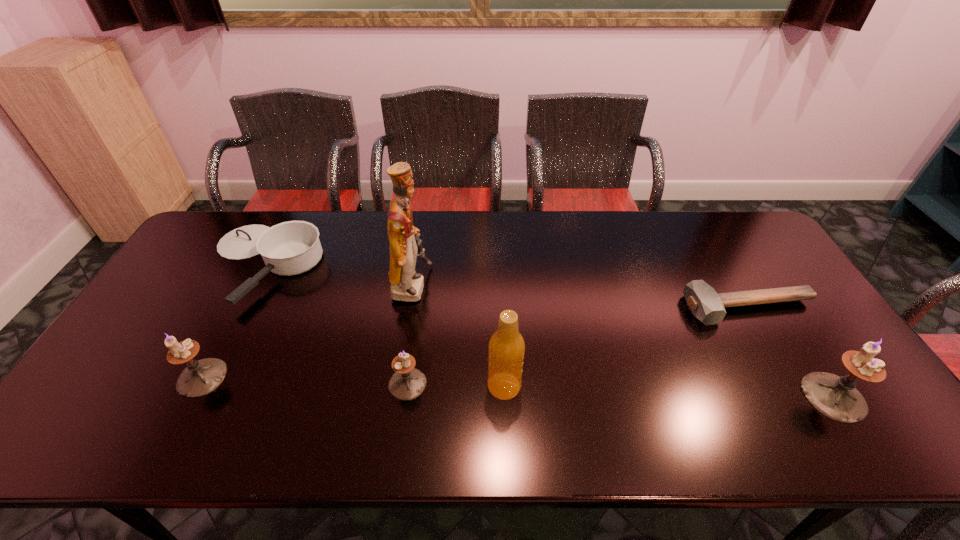
Find the location of a particular element. The height and width of the screenshot is (540, 960). object that is the second closest to the tallest candle holder is located at coordinates (506, 349).

Locate which candle holder ranks second in proximity to the second candle holder from left to right. Please provide its 2D coordinates. Your answer should be formatted as a tuple, i.e. [(x, y)], where the tuple contains the x and y coordinates of a point satisfying the conditions above.

[(835, 397)]

The width and height of the screenshot is (960, 540). Find the location of `candle holder that is the closest one to the rightmost candle holder`. candle holder that is the closest one to the rightmost candle holder is located at coordinates 407,383.

The width and height of the screenshot is (960, 540). In order to click on vacant area in the image that satisfies the following two spatial constraints: 1. on the front-facing side of the nutcracker; 2. on the right side of the sixth shortest object in this screenshot , I will do `click(396, 386)`.

At what (x,y) coordinates should I click in order to perform the action: click on free location that satisfies the following two spatial constraints: 1. on the front-facing side of the tallest object; 2. on the right side of the second tallest object. Please return your answer as a coordinate pair (x, y). The width and height of the screenshot is (960, 540). Looking at the image, I should click on (396, 386).

Find the location of a particular element. vacant area in the image that satisfies the following two spatial constraints: 1. on the back side of the third tallest object; 2. on the front-facing side of the nutcracker is located at coordinates (762, 287).

Locate an element on the screen. vacant space that satisfies the following two spatial constraints: 1. on the front-facing side of the tallest object; 2. on the right side of the fifth tallest object is located at coordinates (396, 383).

This screenshot has height=540, width=960. I want to click on free space in the image that satisfies the following two spatial constraints: 1. on the front side of the saucepan; 2. on the left side of the mallet, so click(x=240, y=309).

Identify the location of free location that satisfies the following two spatial constraints: 1. on the front-facing side of the tallest object; 2. on the left side of the rightmost candle holder. (395, 397).